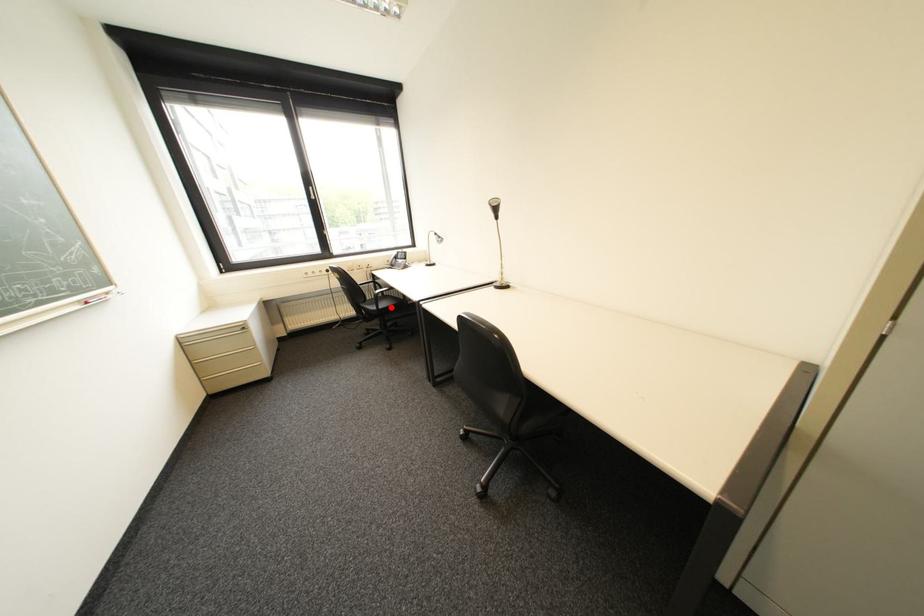
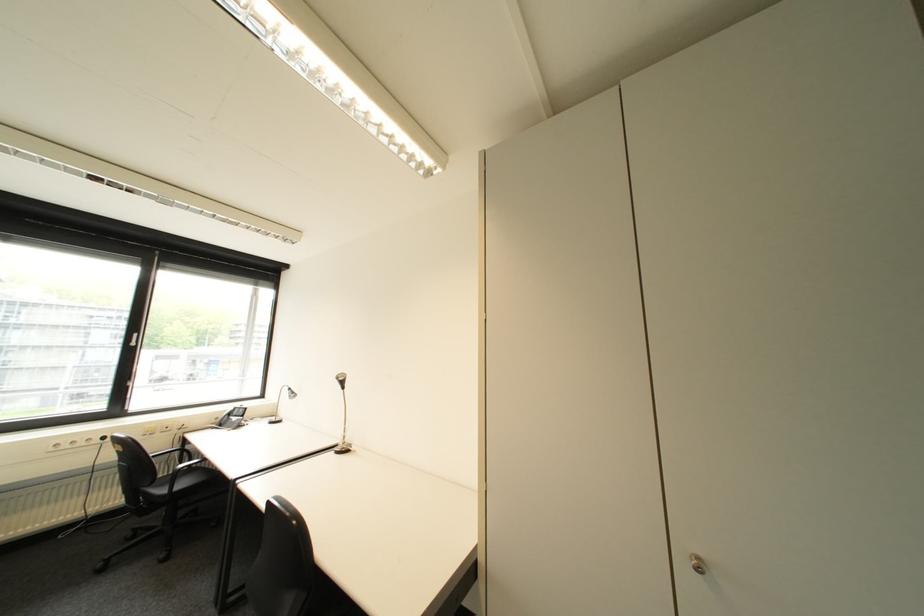
The point at the highlighted location is marked in the first image. Where is the corresponding point in the second image?

(187, 488)